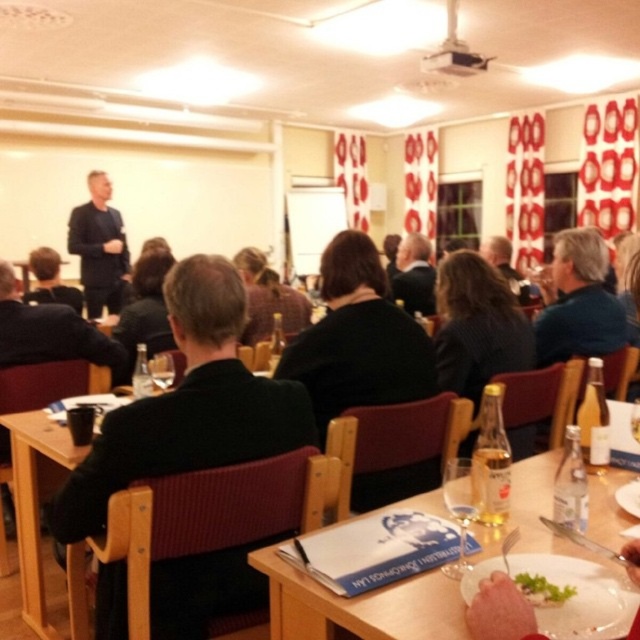
You are attending a meeting in the conference room and need to place a small notepad on the table. The notepad must be placed to the left of the black fabric jacket at center. Where should you place it?

The black fabric jacket at center is located at point (188, 404). To place the notepad to the left of it, position it to the left side of the jacket on the table.

Consider the image. You are standing at the entrance of the conference room and see two points marked in the scene. The first point is at coordinate point (x=474, y=556) and the second is at point (x=81, y=292). Which point is closer to you as you face the room?

Point (x=474, y=556) is in front of point (x=81, y=292), so the first point is closer to you as you face the room.

You are sitting at the wooden table at lower center and want to reach the black fabric jacket at center. In which direction should you move to grab it?

The black fabric jacket at center is to the left of the wooden table at lower center, so you should move to your left to grab it.